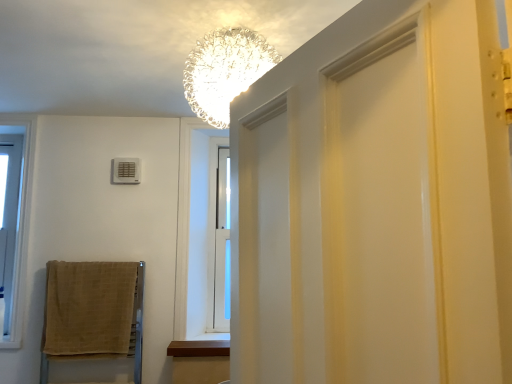
Question: From a real-world perspective, is beige woven towel at lower left on top of white plastic air conditioner at upper left?

Choices:
 (A) yes
 (B) no

Answer: (B)

Question: Considering the relative sizes of beige woven towel at lower left and white plastic air conditioner at upper left in the image provided, is beige woven towel at lower left bigger than white plastic air conditioner at upper left?

Choices:
 (A) yes
 (B) no

Answer: (A)

Question: Can you confirm if beige woven towel at lower left is shorter than white plastic air conditioner at upper left?

Choices:
 (A) yes
 (B) no

Answer: (B)

Question: Could you tell me if beige woven towel at lower left is turned towards white plastic air conditioner at upper left?

Choices:
 (A) yes
 (B) no

Answer: (B)

Question: Is the position of beige woven towel at lower left more distant than that of white plastic air conditioner at upper left?

Choices:
 (A) yes
 (B) no

Answer: (B)

Question: Would you say beige woven towel at lower left contains white plastic air conditioner at upper left?

Choices:
 (A) no
 (B) yes

Answer: (A)

Question: Is brown wood at lower center smaller than beige woven towel at lower left?

Choices:
 (A) no
 (B) yes

Answer: (B)

Question: From a real-world perspective, is brown wood at lower center below beige woven towel at lower left?

Choices:
 (A) yes
 (B) no

Answer: (A)

Question: Can you confirm if brown wood at lower center is thinner than beige woven towel at lower left?

Choices:
 (A) yes
 (B) no

Answer: (B)

Question: Can you confirm if brown wood at lower center is taller than beige woven towel at lower left?

Choices:
 (A) yes
 (B) no

Answer: (B)

Question: From a real-world perspective, is brown wood at lower center located higher than beige woven towel at lower left?

Choices:
 (A) no
 (B) yes

Answer: (A)

Question: Does brown wood at lower center have a lesser height compared to beige woven towel at lower left?

Choices:
 (A) no
 (B) yes

Answer: (B)

Question: Is beige woven towel at lower left behind brown wood at lower center?

Choices:
 (A) no
 (B) yes

Answer: (A)